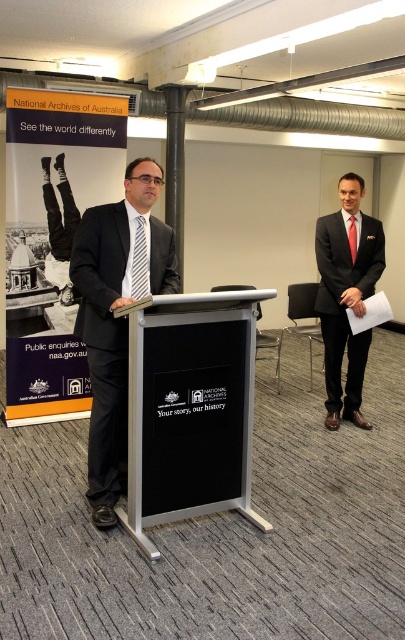
You are an event planner arranging a presentation. You need to place a name tag on the podium so it is visible to the audience but not obscured by the speaker. Where should you place the name tag on the metallic silver podium at center relative to the black silk tie at center?

The metallic silver podium at center is located below the black silk tie at center, so placing the name tag on the podium above the current position of the black silk tie at center would ensure visibility without obstruction.

You are standing in the conference room and want to hand a document to the man at the podium. You need to place the document on the nearest object to you between the matte cardboard sign at center and the black silk tie at center. Which object should you choose?

The matte cardboard sign at center is closer to you than the black silk tie at center, so you should place the document on the matte cardboard sign at center.

You are an event planner setting up a conference room. You have a matte cardboard sign at center and a black silk tie at center. Which object should you place higher on the podium to ensure visibility for the audience?

The matte cardboard sign at center should be placed higher on the podium because it is much taller than the black silk tie at center, making it more visible to the audience.